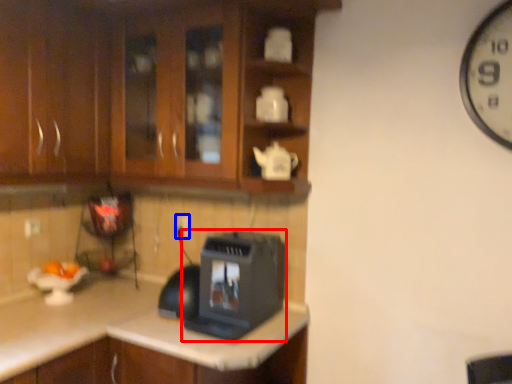
Question: Which of the following is the farthest to the observer, home appliance (highlighted by a red box) or electric outlet (highlighted by a blue box)?

Choices:
 (A) home appliance
 (B) electric outlet

Answer: (B)